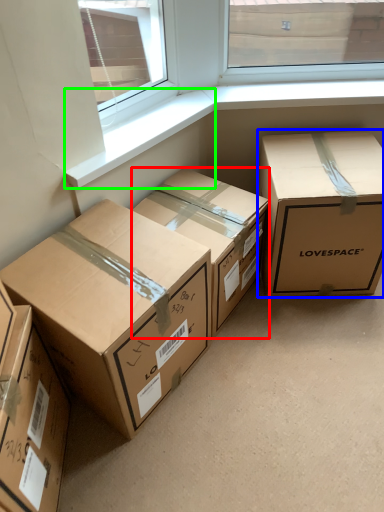
Question: Which object is positioned farthest from box (highlighted by a red box)? Select from box (highlighted by a blue box) and window sill (highlighted by a green box).

Choices:
 (A) box
 (B) window sill

Answer: (B)